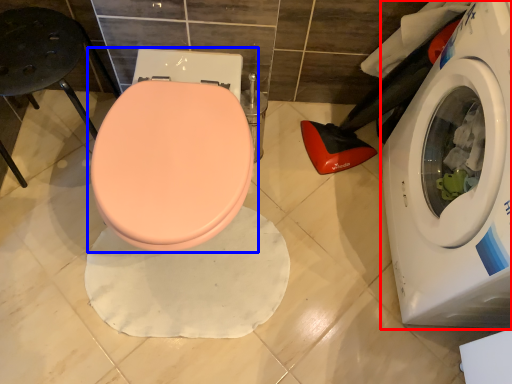
Question: Which of the following is the closest to the observer, washing machine (highlighted by a red box) or toilet (highlighted by a blue box)?

Choices:
 (A) washing machine
 (B) toilet

Answer: (A)